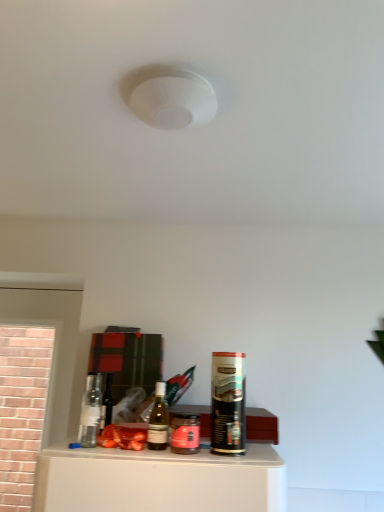
Question: Is matte glass wine bottle at center at the left side of pink glass jar at center, which is counted as the 1th beverage, starting from the left?

Choices:
 (A) yes
 (B) no

Answer: (A)

Question: From a real-world perspective, is matte glass wine bottle at center located higher than pink glass jar at center, which is counted as the 1th beverage, starting from the left?

Choices:
 (A) no
 (B) yes

Answer: (B)

Question: Considering the relative positions of matte glass wine bottle at center and pink glass jar at center, which is counted as the 1th beverage, starting from the left, in the image provided, is matte glass wine bottle at center to the right of pink glass jar at center, which is counted as the 1th beverage, starting from the left, from the viewer's perspective?

Choices:
 (A) yes
 (B) no

Answer: (B)

Question: Does matte glass wine bottle at center have a smaller size compared to pink glass jar at center, which is counted as the 1th beverage, starting from the left?

Choices:
 (A) yes
 (B) no

Answer: (A)

Question: Is matte glass wine bottle at center oriented towards pink glass jar at center, which is counted as the 1th beverage, starting from the left?

Choices:
 (A) yes
 (B) no

Answer: (B)

Question: Looking at their shapes, would you say pink glass jar at center, which appears as the 2th beverage when viewed from the right, is wider or thinner than black matte spray can at right, placed as the first beverage when sorted from right to left?

Choices:
 (A) wide
 (B) thin

Answer: (B)

Question: In terms of size, does pink glass jar at center, which appears as the 2th beverage when viewed from the right, appear bigger or smaller than black matte spray can at right, placed as the first beverage when sorted from right to left?

Choices:
 (A) big
 (B) small

Answer: (B)

Question: Is point (187, 425) closer or farther from the camera than point (236, 431)?

Choices:
 (A) farther
 (B) closer

Answer: (B)

Question: From the image's perspective, is pink glass jar at center, which appears as the 2th beverage when viewed from the right, positioned above or below black matte spray can at right, arranged as the 2th beverage when viewed from the left?

Choices:
 (A) above
 (B) below

Answer: (B)

Question: From the image's perspective, is pink glass jar at center, which appears as the 2th beverage when viewed from the right, above or below translucent glass bottle at center?

Choices:
 (A) below
 (B) above

Answer: (A)

Question: Would you say pink glass jar at center, which appears as the 2th beverage when viewed from the right, is inside or outside translucent glass bottle at center?

Choices:
 (A) outside
 (B) inside

Answer: (A)

Question: Is pink glass jar at center, which is counted as the 1th beverage, starting from the left, wider or thinner than translucent glass bottle at center?

Choices:
 (A) wide
 (B) thin

Answer: (A)

Question: Relative to translucent glass bottle at center, is pink glass jar at center, which is counted as the 1th beverage, starting from the left, in front or behind?

Choices:
 (A) behind
 (B) front

Answer: (B)

Question: Is pink glass jar at center, which appears as the 2th beverage when viewed from the right, situated inside matte glass wine bottle at center or outside?

Choices:
 (A) outside
 (B) inside

Answer: (A)

Question: From a real-world perspective, relative to matte glass wine bottle at center, is pink glass jar at center, which is counted as the 1th beverage, starting from the left, vertically above or below?

Choices:
 (A) above
 (B) below

Answer: (B)